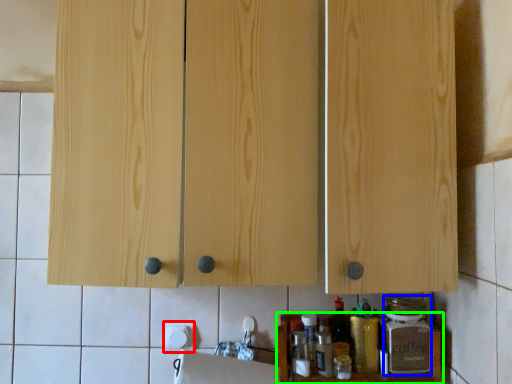
Question: Which object is the farthest from paper towel (highlighted by a red box)? Choose among these: bottle (highlighted by a blue box) or cabinet (highlighted by a green box).

Choices:
 (A) bottle
 (B) cabinet

Answer: (A)